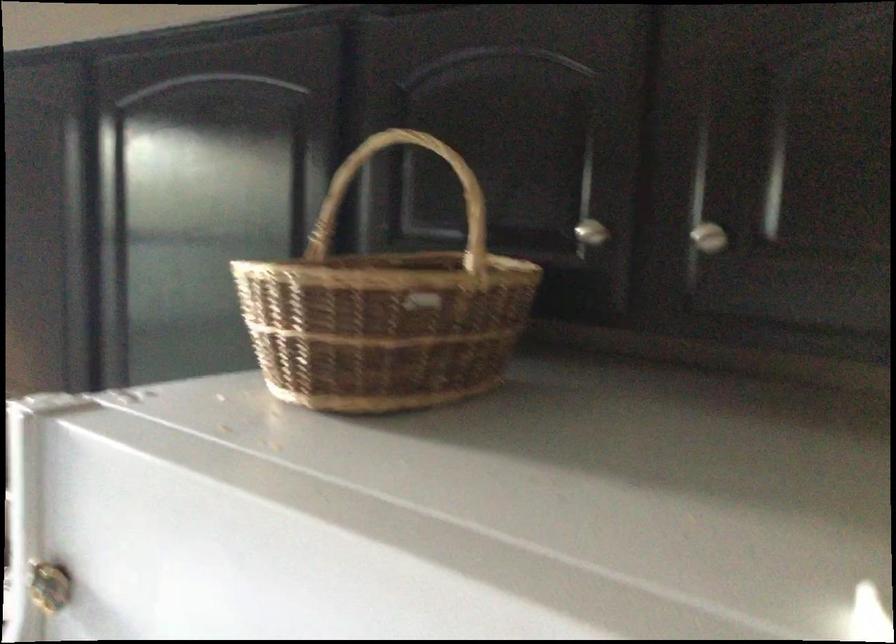
Locate an element on the screen. wicker basket handle is located at coordinates (428, 182).